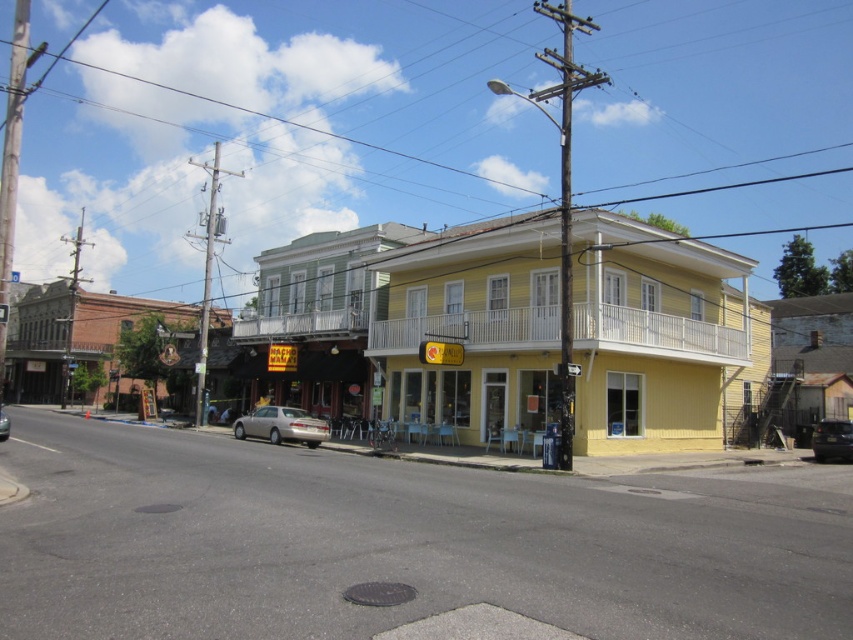
Question: Is brushed metal pole at left above matte silver sedan at center?

Choices:
 (A) no
 (B) yes

Answer: (B)

Question: Which of these objects is positioned farthest from the metallic gray utility pole at left?

Choices:
 (A) matte silver sedan at center
 (B) metallic silver car at lower right
 (C) brushed metal pole at left
 (D) yellow matte building at center

Answer: (A)

Question: Is brushed metal pole at left closer to camera compared to matte silver sedan at center?

Choices:
 (A) yes
 (B) no

Answer: (A)

Question: Which object is the closest to the yellow painted building at center?

Choices:
 (A) metallic gray pole at center
 (B) brushed metal pole at left
 (C) yellow matte building at center
 (D) gold metallic sedan at center

Answer: (C)

Question: Which point is farther to the camera?

Choices:
 (A) matte silver sedan at center
 (B) yellow matte building at center
 (C) brushed metal pole at left

Answer: (A)

Question: Is metallic gray pole at center positioned behind gold metallic sedan at center?

Choices:
 (A) no
 (B) yes

Answer: (A)